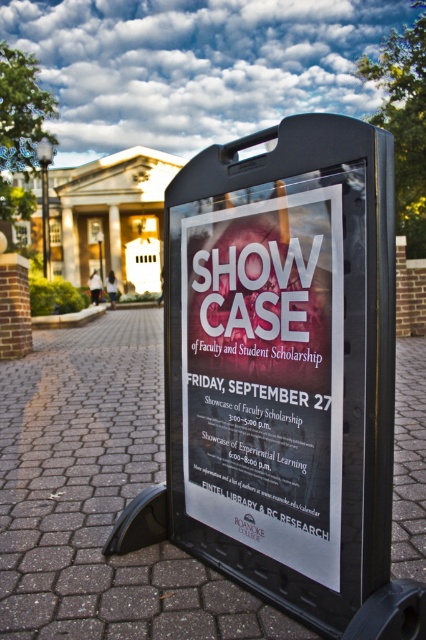
You are walking on the brown cobblestone pavement at center and want to place the black plastic sign at center on the pavement. Can the pavement accommodate the sign in terms of width?

The brown cobblestone pavement at center is wider than the black plastic sign at center, so the pavement can accommodate the sign in terms of width.